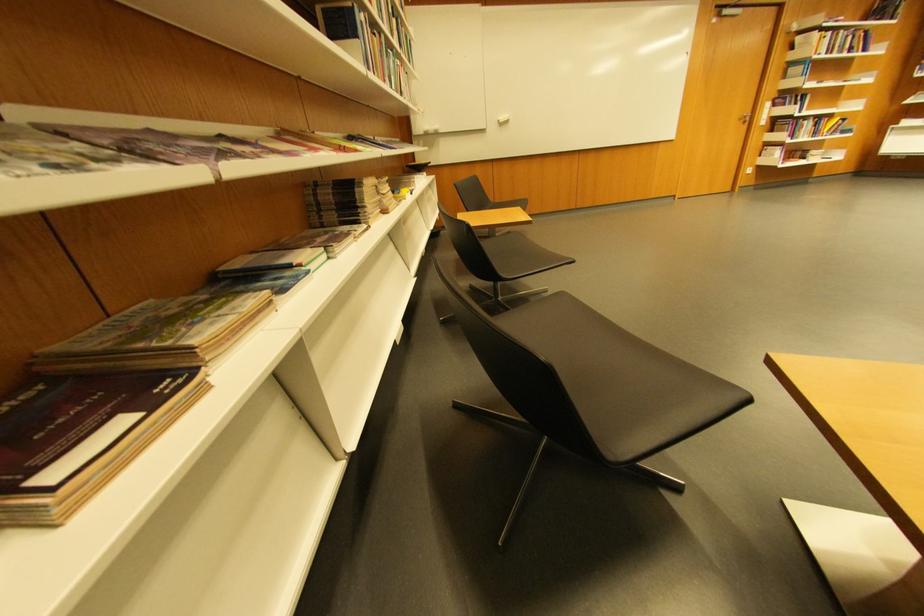
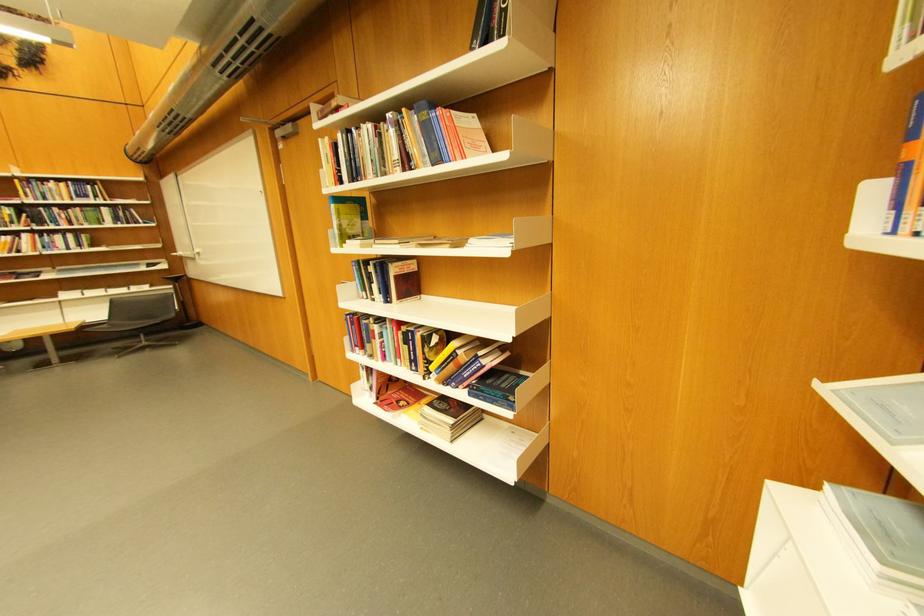
Where in the second image is the point corresponding to point (847, 36) from the first image?

(370, 137)